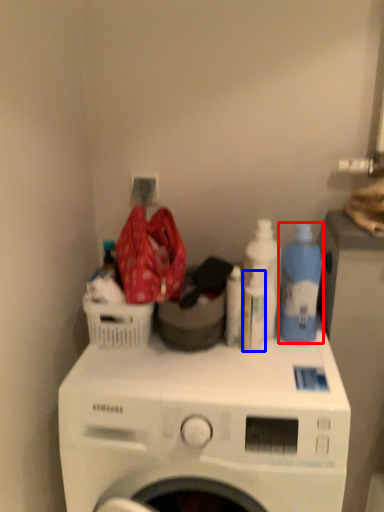
Question: Which object is further to the camera taking this photo, cleaning product (highlighted by a red box) or bottle (highlighted by a blue box)?

Choices:
 (A) cleaning product
 (B) bottle

Answer: (B)